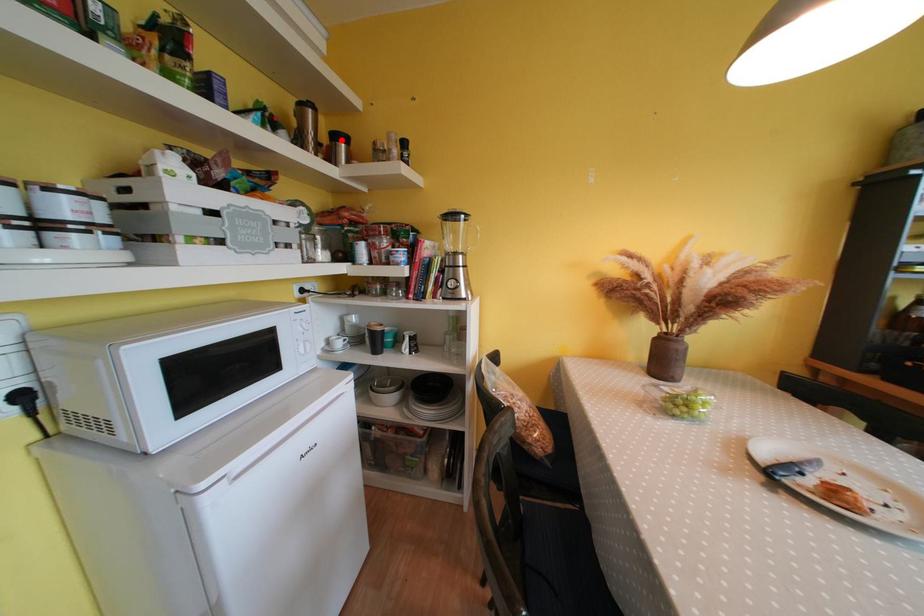
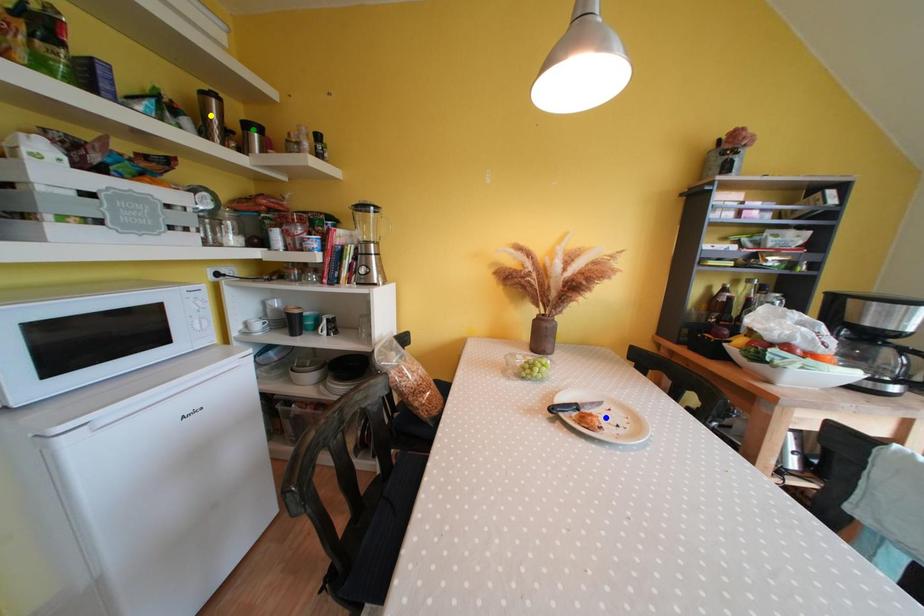
Question: I am providing you with two images of the same scene from different viewpoints. A red point is marked on the first image. You are given multiple points on the second image. Can you choose the point in image 2 that corresponds to the point in image 1?

Choices:
 (A) blue point
 (B) green point
 (C) yellow point

Answer: (B)